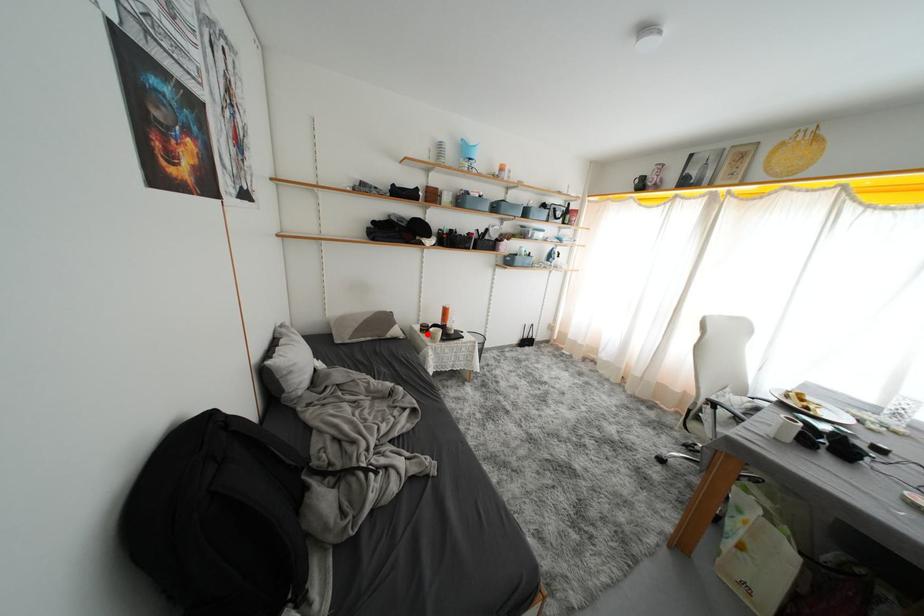
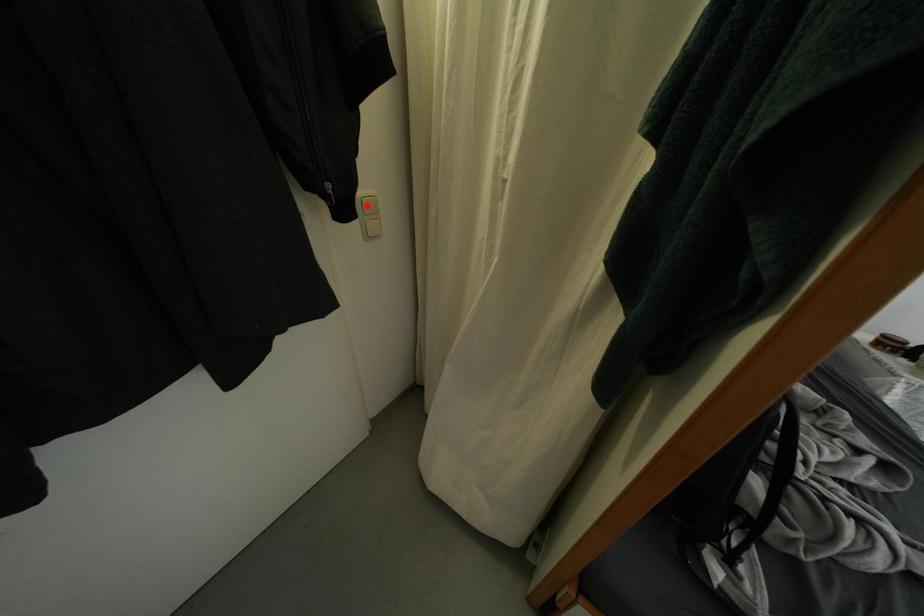
I am providing you with two images of the same scene from different viewpoints. A red point is marked on the first image and another point is marked on the second image. Are the points marked in image1 and image2 representing the same 3D position?

No